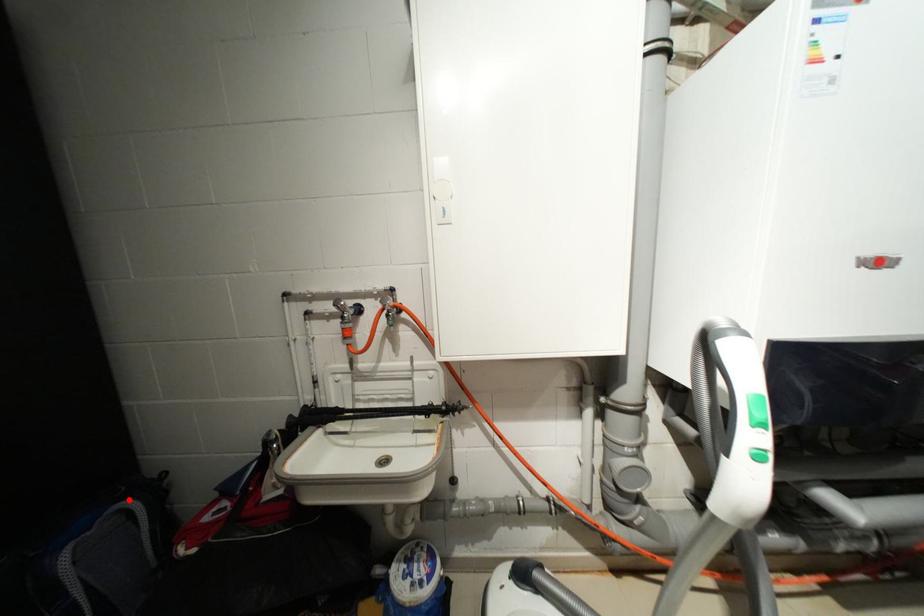
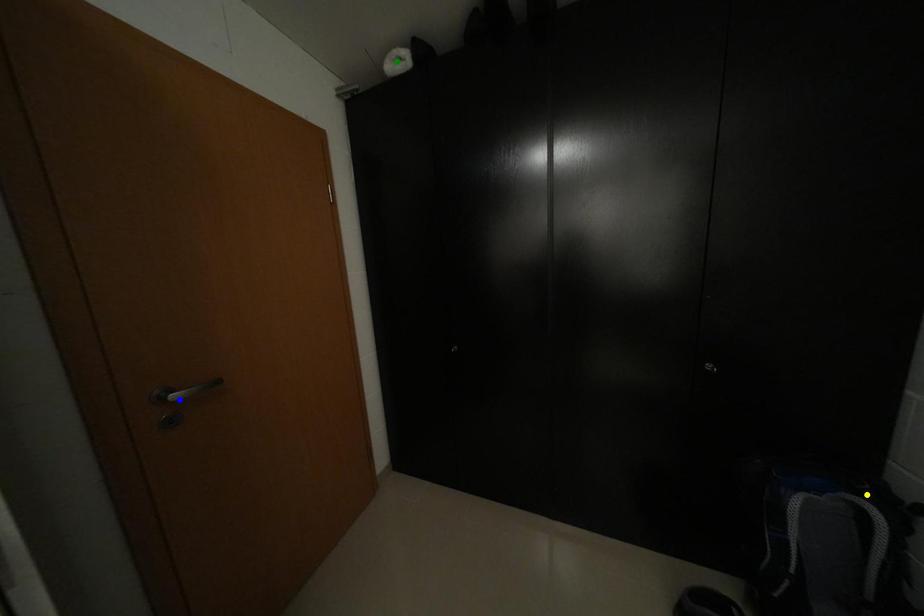
Question: I am providing you with two images of the same scene from different viewpoints. A red point is marked on the first image. You are given multiple points on the second image. In image 2, which mark is for the same physical point as the one in image 1?

Choices:
 (A) blue point
 (B) green point
 (C) yellow point

Answer: (C)